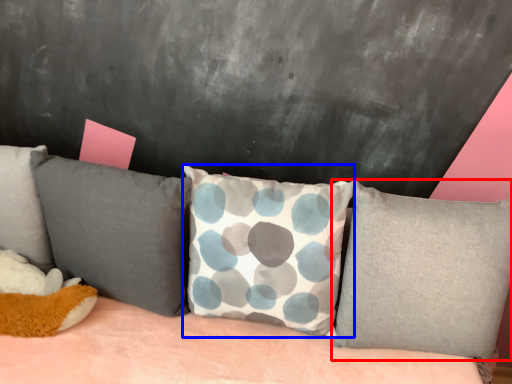
Question: Which point is further to the camera, pillow (highlighted by a red box) or pillow (highlighted by a blue box)?

Choices:
 (A) pillow
 (B) pillow

Answer: (A)